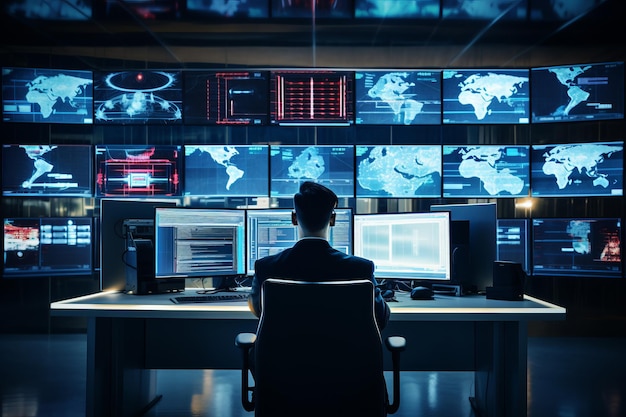
Find the location of a particular element. This screenshot has height=417, width=626. monitors with red on their display is located at coordinates pos(39,241), pos(153,165), pos(213,108), pos(310,99), pos(565,230), pos(156,16).